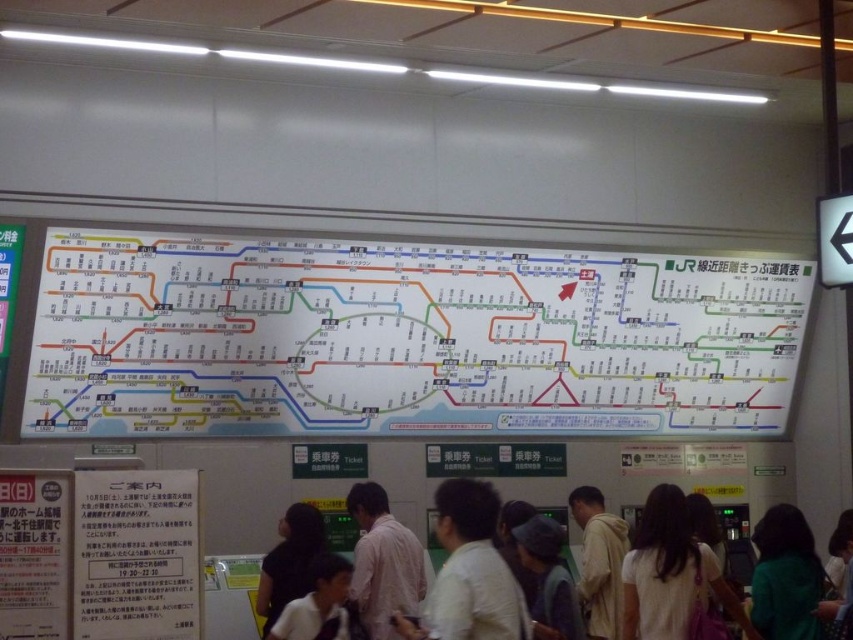
Question: Which object is closer to the camera taking this photo?

Choices:
 (A) light beige shirt at center
 (B) white cotton shirt at lower right

Answer: (A)

Question: Which is nearer to the light beige hoodie at center?

Choices:
 (A) white paper map at center
 (B) light pink shirt at center

Answer: (B)

Question: Does light beige shirt at center come in front of dark gray fabric cap at center?

Choices:
 (A) yes
 (B) no

Answer: (A)

Question: Which point is closer to the camera?

Choices:
 (A) (816, 593)
 (B) (640, 572)

Answer: (B)

Question: Does green fabric shirt at lower right appear on the left side of dark gray shirt at center?

Choices:
 (A) no
 (B) yes

Answer: (A)

Question: Can you confirm if white cotton shirt at lower right is positioned to the right of white shirt at center?

Choices:
 (A) yes
 (B) no

Answer: (B)